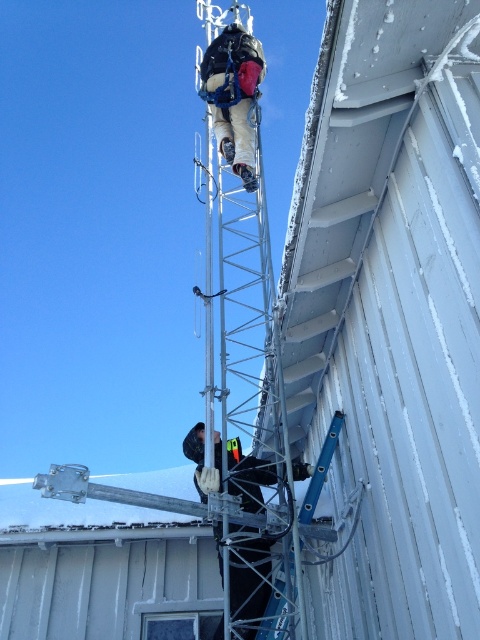
You are a safety inspector reviewing the image of the communication tower installation. You notice two items at the worksite. Which item is positioned lower in the scene between the black fabric gloves at center and the matte black harness at upper center?

The black fabric gloves at center are positioned lower than the matte black harness at upper center because the gloves have a lesser height compared to the harness.

In the scene shown: You are standing at the base of the communication tower and see the black fabric gloves at center. If you want to throw a tool to the person wearing the gloves, and the tool has a maximum throwing distance of 5 meters, will you be able to reach them?

The distance between you and the black fabric gloves at center is 5.17 meters, which exceeds the tool throwing distance of 5 meters. Therefore, you cannot reach them by throwing the tool.